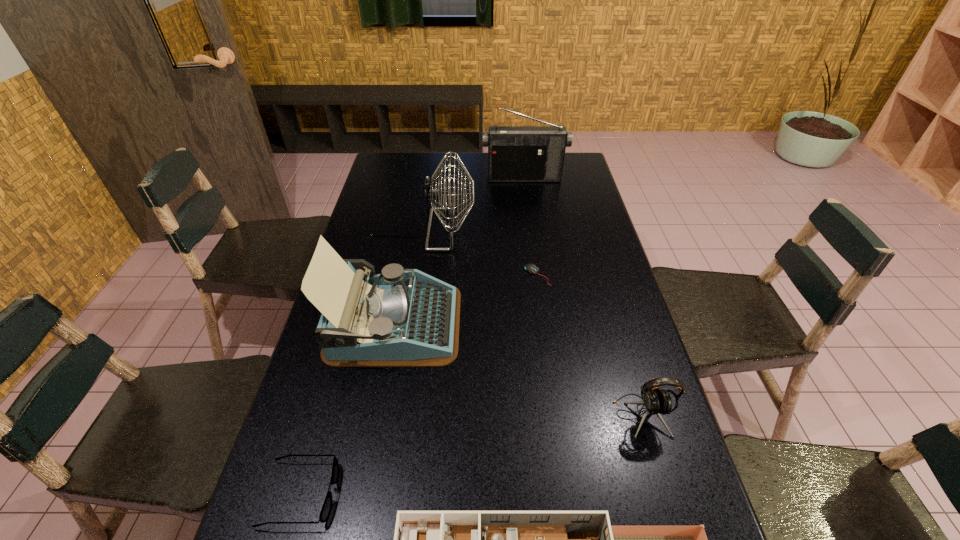
Identify which object is the fifth closest to the fourth shortest object. Please provide its 2D coordinates. Your answer should be formatted as a tuple, i.e. [(x, y)], where the tuple contains the x and y coordinates of a point satisfying the conditions above.

[(432, 192)]

Identify the location of free space that satisfies the following two spatial constraints: 1. on the front-facing side of the farthest object; 2. on the typing side of the typewriter. (544, 323).

The image size is (960, 540). Find the location of `vacant region that satisfies the following two spatial constraints: 1. on the back side of the third nearest object; 2. on the front-facing side of the fan`. vacant region that satisfies the following two spatial constraints: 1. on the back side of the third nearest object; 2. on the front-facing side of the fan is located at coordinates (587, 230).

Find the location of a particular element. The width and height of the screenshot is (960, 540). vacant region that satisfies the following two spatial constraints: 1. on the front-facing side of the farthest object; 2. on the typing side of the fifth shortest object is located at coordinates (544, 323).